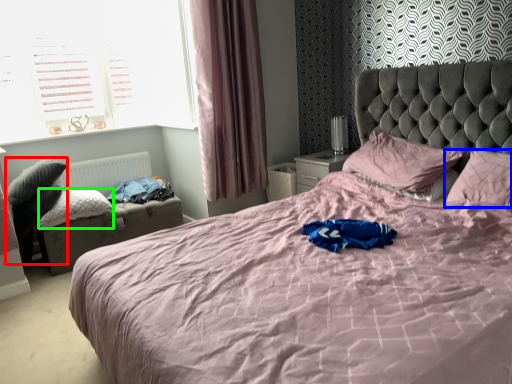
Question: Considering the real-world distances, which object is farthest from swivel chair (highlighted by a red box)? pillow (highlighted by a blue box) or pillow (highlighted by a green box)?

Choices:
 (A) pillow
 (B) pillow

Answer: (A)